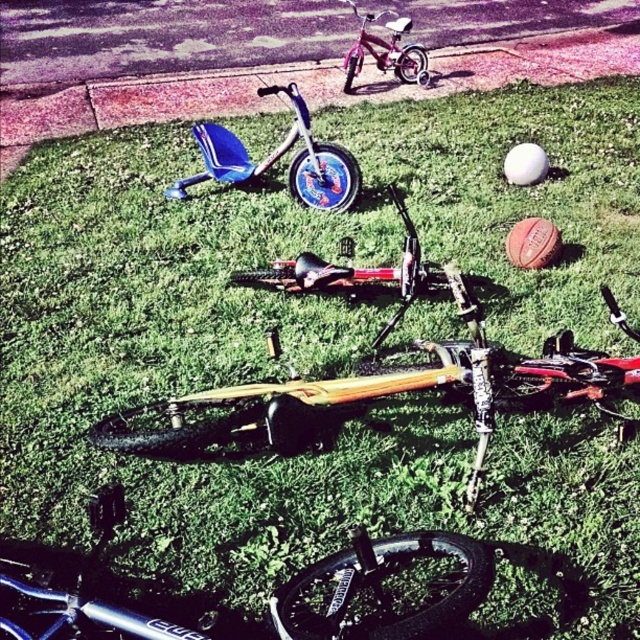
You are a parent trying to decide which toy to put away first. You see the yellow matte bicycle at center and the blue plastic tricycle at center. Which one is larger?

The yellow matte bicycle at center is bigger than the blue plastic tricycle at center, so the yellow matte bicycle at center is larger.

What is located at the point with coordinates (376, 372) in the scene?

The point at coordinates (376, 372) indicates the location of the yellow matte bicycle at center.

You are standing in the grassy area where the children left their bicycles and scooters. You want to pick up the item closest to you. Which point, point (480, 353) or point (278, 154), should you go to first?

Point (480, 353) is closer to the viewer than point (278, 154), so you should go to point (480, 353) first.